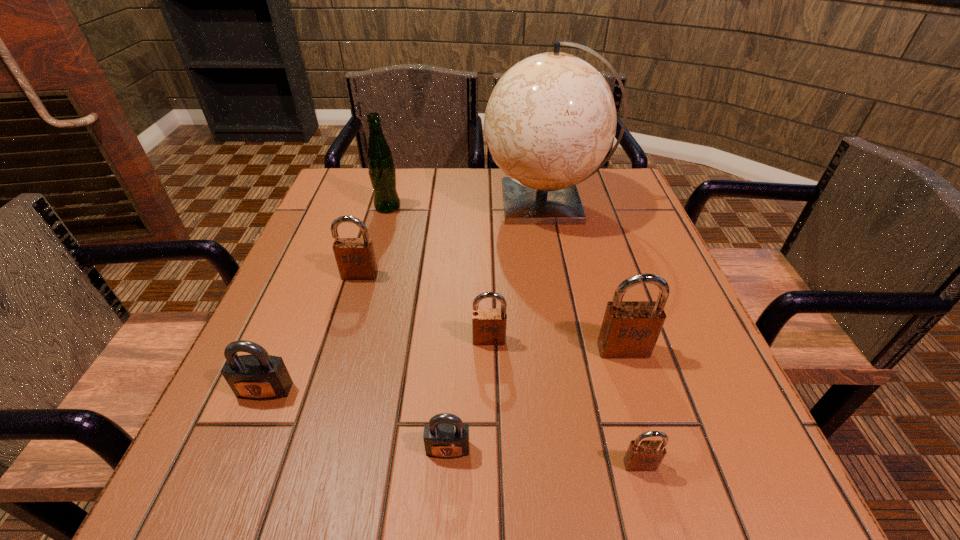
At what (x,y) coordinates should I click in order to perform the action: click on empty space that is in between the leftmost object and the sixth nearest object. Please return your answer as a coordinate pair (x, y). This screenshot has width=960, height=540. Looking at the image, I should click on (312, 333).

Identify the location of vacant area that lies between the fifth shortest padlock and the third padlock from right to left. (424, 307).

At what (x,y) coordinates should I click in order to perform the action: click on empty space between the beer bottle and the second brown padlock from left to right. Please return your answer as a coordinate pair (x, y). The height and width of the screenshot is (540, 960). Looking at the image, I should click on (439, 273).

Locate an element on the screen. This screenshot has width=960, height=540. free area in between the globe and the green beer bottle is located at coordinates (467, 205).

Identify the location of free space between the sixth farthest object and the tallest padlock. This screenshot has height=540, width=960. (444, 370).

At what (x,y) coordinates should I click in order to perform the action: click on empty space that is in between the second brown padlock from left to right and the farthest brown padlock. Please return your answer as a coordinate pair (x, y). This screenshot has width=960, height=540. Looking at the image, I should click on (424, 307).

This screenshot has width=960, height=540. In order to click on object that stands as the closest to the nearest brown padlock in this screenshot , I will do `click(630, 329)`.

Identify which object is the fifth closest to the second brown padlock from left to right. Please provide its 2D coordinates. Your answer should be formatted as a tuple, i.e. [(x, y)], where the tuple contains the x and y coordinates of a point satisfying the conditions above.

[(551, 119)]

Locate an element on the screen. The image size is (960, 540). the third closest padlock relative to the green beer bottle is located at coordinates (259, 376).

Select which padlock is the fifth closest to the fifth object from right to left. Please provide its 2D coordinates. Your answer should be formatted as a tuple, i.e. [(x, y)], where the tuple contains the x and y coordinates of a point satisfying the conditions above.

[(355, 257)]